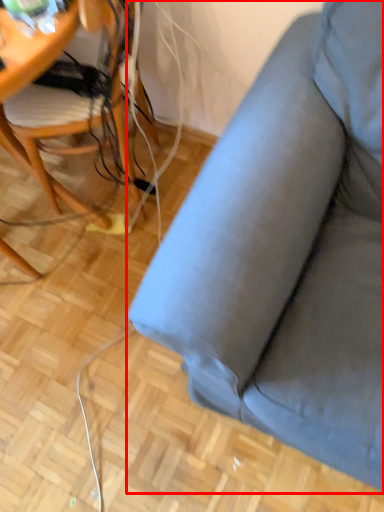
Question: Considering the relative positions of studio couch (annotated by the red box) and chair in the image provided, where is studio couch (annotated by the red box) located with respect to the staircase?

Choices:
 (A) left
 (B) right

Answer: (B)